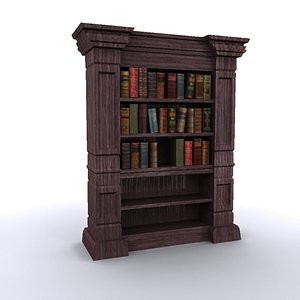
At what (x,y) coordinates should I click in order to perform the action: click on books on 3rd shelf. Please return your answer as a coordinate pair (x, y). Looking at the image, I should click on (128, 156), (134, 156), (145, 153), (154, 152), (181, 151), (188, 153), (199, 154), (203, 153).